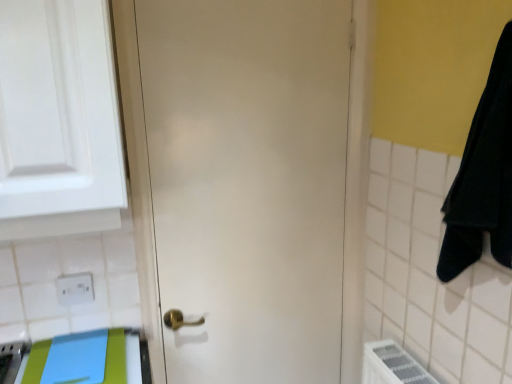
Question: From the image's perspective, is blue fabric beach towel at lower left located beneath white matte door at center?

Choices:
 (A) yes
 (B) no

Answer: (A)

Question: Is white matte door at center completely or partially inside blue fabric beach towel at lower left?

Choices:
 (A) no
 (B) yes

Answer: (A)

Question: Considering the relative positions of blue fabric beach towel at lower left and white matte door at center in the image provided, is blue fabric beach towel at lower left to the left of white matte door at center from the viewer's perspective?

Choices:
 (A) no
 (B) yes

Answer: (B)

Question: Can you confirm if blue fabric beach towel at lower left is bigger than white matte door at center?

Choices:
 (A) no
 (B) yes

Answer: (A)

Question: Does blue fabric beach towel at lower left lie behind white matte door at center?

Choices:
 (A) no
 (B) yes

Answer: (A)

Question: Is blue fabric beach towel at lower left to the left or to the right of white matte door at center in the image?

Choices:
 (A) right
 (B) left

Answer: (B)

Question: Considering the positions of blue fabric beach towel at lower left and white matte door at center in the image, is blue fabric beach towel at lower left wider or thinner than white matte door at center?

Choices:
 (A) wide
 (B) thin

Answer: (A)

Question: Is blue fabric beach towel at lower left bigger or smaller than white matte door at center?

Choices:
 (A) big
 (B) small

Answer: (B)

Question: Is blue fabric beach towel at lower left in front of or behind white matte door at center in the image?

Choices:
 (A) front
 (B) behind

Answer: (A)

Question: In terms of height, does white matte door at center look taller or shorter compared to white plastic electric outlet at lower left?

Choices:
 (A) short
 (B) tall

Answer: (B)

Question: Is white matte door at center to the left or to the right of white plastic electric outlet at lower left in the image?

Choices:
 (A) left
 (B) right

Answer: (B)

Question: From the image's perspective, is white matte door at center located above or below white plastic electric outlet at lower left?

Choices:
 (A) below
 (B) above

Answer: (B)

Question: Is white matte door at center in front of or behind white plastic electric outlet at lower left in the image?

Choices:
 (A) front
 (B) behind

Answer: (A)

Question: Considering the relative positions of white plastic electric outlet at lower left and white glossy cabinet at upper left in the image provided, is white plastic electric outlet at lower left to the left or to the right of white glossy cabinet at upper left?

Choices:
 (A) right
 (B) left

Answer: (B)

Question: Considering the positions of point (93, 299) and point (2, 26), is point (93, 299) closer or farther from the camera than point (2, 26)?

Choices:
 (A) farther
 (B) closer

Answer: (A)